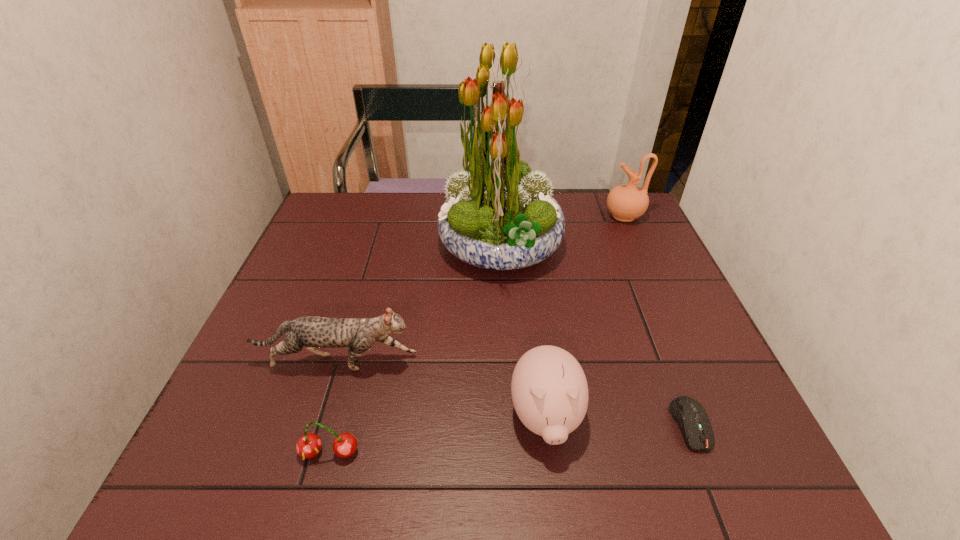
This screenshot has height=540, width=960. I want to click on the tallest object, so click(498, 215).

The width and height of the screenshot is (960, 540). I want to click on pottery, so click(627, 202).

Find the location of `cat`. cat is located at coordinates [359, 334].

Where is `piggy bank`? piggy bank is located at coordinates (549, 389).

Locate an element on the screen. Image resolution: width=960 pixels, height=540 pixels. cherry is located at coordinates (309, 445).

The image size is (960, 540). What are the coordinates of `computer equipment` in the screenshot? It's located at (692, 419).

The width and height of the screenshot is (960, 540). In order to click on vacant area situated 0.110m on the front-facing side of the tallest object in this screenshot , I will do `click(401, 246)`.

Find the location of a particular element. free region located on the front-facing side of the tallest object is located at coordinates (312, 246).

At what (x,y) coordinates should I click in order to perform the action: click on vacant space situated on the front-facing side of the tallest object. Please return your answer as a coordinate pair (x, y). Looking at the image, I should click on pyautogui.click(x=401, y=246).

This screenshot has height=540, width=960. In order to click on free space located 0.100m on the spout of the second tallest object in this screenshot , I will do `click(573, 216)`.